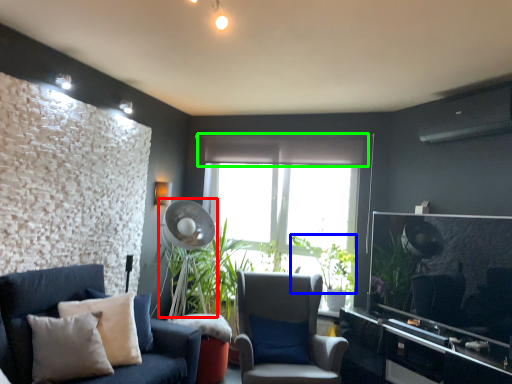
Question: Based on their relative distances, which object is nearer to mechanical fan (highlighted by a red box)? Choose from plant (highlighted by a blue box) and curtain (highlighted by a green box).

Choices:
 (A) plant
 (B) curtain

Answer: (B)